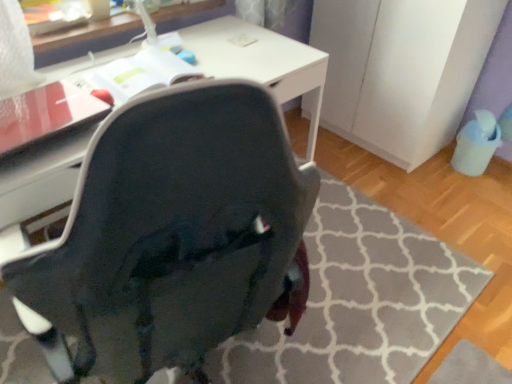
What is the approximate width of white glossy table at upper center?

The width of white glossy table at upper center is 7.79 inches.

Measure the distance between white matte file cabinet at right and camera.

The distance of white matte file cabinet at right from camera is 1.77 meters.

In order to face white matte file cabinet at right, should I rotate leftwards or rightwards?

To align with it, rotate right about 18.070°.

Locate an element on the screen. This screenshot has width=512, height=384. white glossy table at upper center is located at coordinates (86, 39).

Is white matte file cabinet at right bigger or smaller than matte black chair at center?

In the image, white matte file cabinet at right appears to be larger than matte black chair at center.

Which object is closer to the camera taking this photo, white matte file cabinet at right or matte black chair at center?

matte black chair at center is more forward.

At what (x,y) coordinates should I click in order to perform the action: click on chair below the white matte file cabinet at right (from a real-world perspective). Please return your answer as a coordinate pair (x, y). The image size is (512, 384). Looking at the image, I should click on (172, 237).

Is white matte file cabinet at right directly adjacent to matte black chair at center?

No, white matte file cabinet at right is not touching matte black chair at center.

Is matte black chair at center positioned far away from white matte file cabinet at right?

Yes, matte black chair at center is far from white matte file cabinet at right.

Is matte black chair at center taller or shorter than white matte file cabinet at right?

In the image, matte black chair at center appears to be shorter than white matte file cabinet at right.

Is matte black chair at center spatially inside white matte file cabinet at right, or outside of it?

matte black chair at center is located beyond the bounds of white matte file cabinet at right.

Image resolution: width=512 pixels, height=384 pixels. In the image, there is a matte black chair at center. Find the location of `file cabinet above it (from the image's perspective)`. file cabinet above it (from the image's perspective) is located at coordinates (401, 70).

Is white matte file cabinet at right not inside white glossy table at upper center?

That's correct, white matte file cabinet at right is outside of white glossy table at upper center.

Considering the relative sizes of white matte file cabinet at right and white glossy table at upper center in the image provided, is white matte file cabinet at right wider than white glossy table at upper center?

Correct, the width of white matte file cabinet at right exceeds that of white glossy table at upper center.

From a real-world perspective, which object stands above the other?

white glossy table at upper center, from a real-world perspective.

Choose the correct answer: Is matte black chair at center inside white glossy table at upper center or outside it?

matte black chair at center lies outside white glossy table at upper center.

Which of these two, matte black chair at center or white glossy table at upper center, is thinner?

white glossy table at upper center.

Is matte black chair at center next to white glossy table at upper center?

They are not placed beside each other.

Consider the image. Is white glossy table at upper center thinner than matte black chair at center?

Yes, white glossy table at upper center is thinner than matte black chair at center.

Is white glossy table at upper center aimed at matte black chair at center?

No, white glossy table at upper center is not facing towards matte black chair at center.

Is white glossy table at upper center not within matte black chair at center?

That's correct, white glossy table at upper center is outside of matte black chair at center.

Measure the distance between white glossy table at upper center and matte black chair at center.

Result: white glossy table at upper center is 4.07 feet from matte black chair at center.

Is white glossy table at upper center not close to white matte file cabinet at right?

No, there isn't a large distance between white glossy table at upper center and white matte file cabinet at right.

Is the position of white glossy table at upper center more distant than that of white matte file cabinet at right?

No, white glossy table at upper center is closer to the viewer.

Does point (121, 26) come farther from viewer compared to point (386, 95)?

No, it is not.

Which of these two, white glossy table at upper center or white matte file cabinet at right, stands shorter?

white glossy table at upper center.

This screenshot has height=384, width=512. I want to click on file cabinet above the matte black chair at center (from the image's perspective), so pos(401,70).

Identify the location of file cabinet that appears behind the matte black chair at center. The height and width of the screenshot is (384, 512). (401, 70).

Looking at this image, looking at the image, which one is located closer to white matte file cabinet at right, white glossy table at upper center or matte black chair at center?

white glossy table at upper center is positioned closer to the anchor white matte file cabinet at right.

Considering their positions, is white matte file cabinet at right positioned further to white glossy table at upper center than matte black chair at center?

Based on the image, matte black chair at center appears to be further to white glossy table at upper center.

In the scene shown: From the image, which object appears to be farther from white glossy table at upper center, matte black chair at center or white matte file cabinet at right?

matte black chair at center is further to white glossy table at upper center.

From the image, which object appears to be farther from matte black chair at center, white matte file cabinet at right or white glossy table at upper center?

The object further to matte black chair at center is white matte file cabinet at right.

Which object lies nearer to the anchor point matte black chair at center, white glossy table at upper center or white matte file cabinet at right?

The object closer to matte black chair at center is white glossy table at upper center.

From the image, which object appears to be nearer to white matte file cabinet at right, matte black chair at center or white glossy table at upper center?

Based on the image, white glossy table at upper center appears to be nearer to white matte file cabinet at right.

In order to click on table that lies between white matte file cabinet at right and matte black chair at center from top to bottom in this screenshot , I will do `click(86, 39)`.